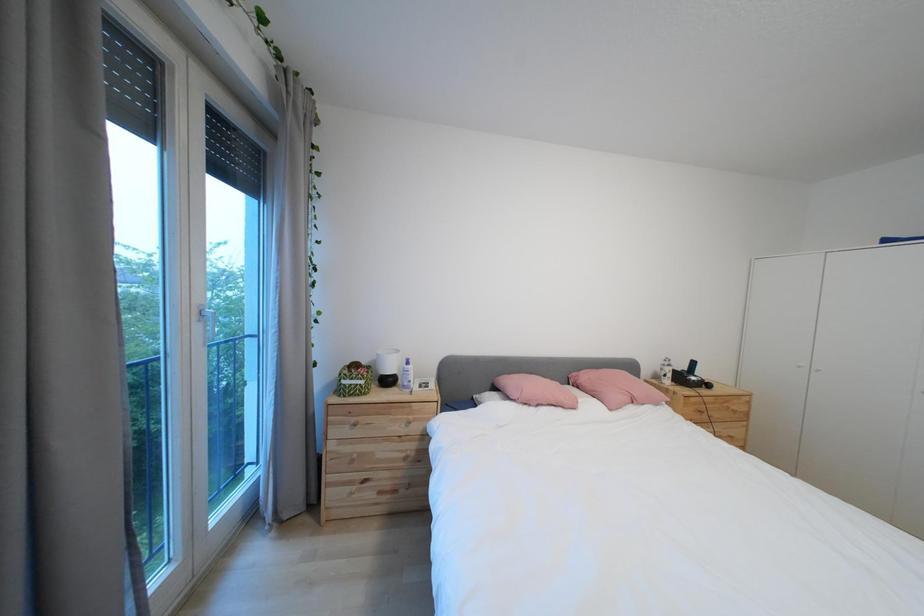
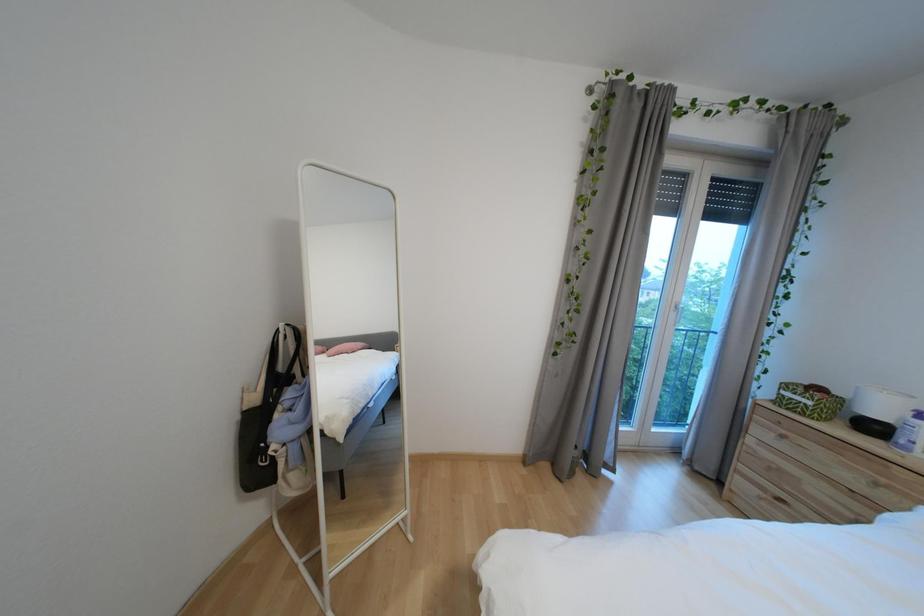
Question: How did the camera likely rotate?

Choices:
 (A) Left
 (B) Right
 (C) Up
 (D) Down

Answer: (A)